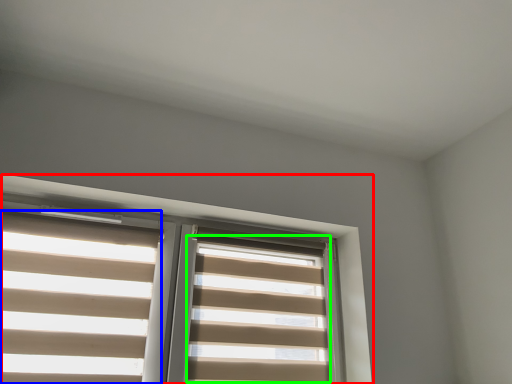
Question: Which object is positioned closest to window (highlighted by a red box)? Select from blind (highlighted by a blue box) and blind (highlighted by a green box).

Choices:
 (A) blind
 (B) blind

Answer: (B)